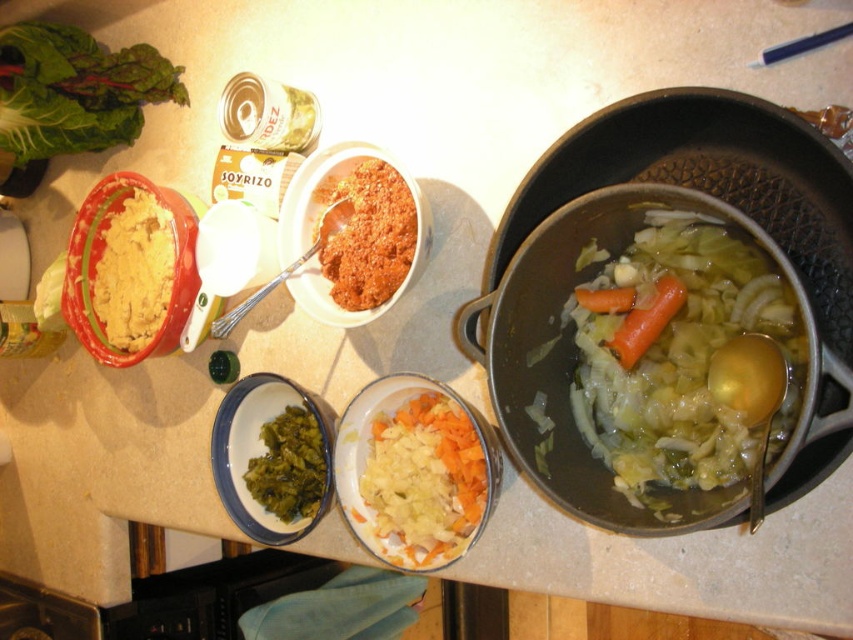
Where is the translucent glass bowl at center located in the image?

The translucent glass bowl at center is located at point 0.558 on the x axis and point 0.800 on the y axis.

You are a chef preparing a dish and need to locate the green leafy vegetable at upper left. According to the coordinates provided, where exactly is it placed on the kitchen countertop?

The green leafy vegetable at upper left is located at coordinates point (x=74, y=90) on the kitchen countertop.